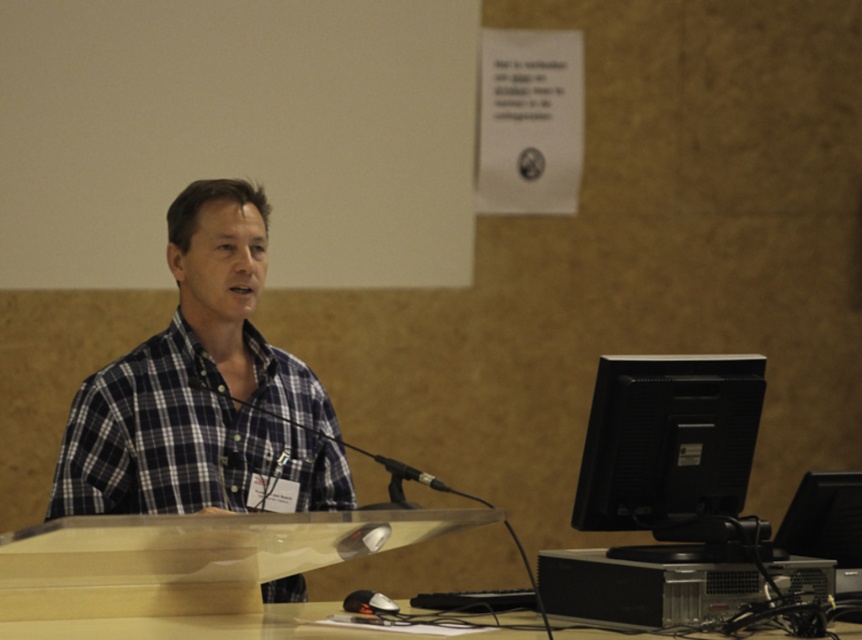
Is clear plastic table at center positioned at the back of wooden table at lower center?

No.

Is point (173, 522) behind point (191, 632)?

That is False.

You are a GUI agent. You are given a task and a screenshot of the screen. Output one action in this format:
    pyautogui.click(x=<x>, y=<y>)
    Task: Click on the clear plastic table at center
    The width and height of the screenshot is (862, 640).
    Given the screenshot: What is the action you would take?
    point(192,557)

I want to click on clear plastic table at center, so click(x=192, y=557).

Between plaid cotton shirt at center and black matte microphone at center, which one has less height?

black matte microphone at center

From the picture: Can you confirm if plaid cotton shirt at center is positioned above black matte microphone at center?

Yes.

Image resolution: width=862 pixels, height=640 pixels. I want to click on plaid cotton shirt at center, so click(x=203, y=390).

Is wooden table at lower center closer to camera compared to black matte microphone at center?

Yes, wooden table at lower center is closer to the viewer.

Can you confirm if wooden table at lower center is positioned to the left of black matte microphone at center?

No, wooden table at lower center is not to the left of black matte microphone at center.

Does point (19, 636) lie behind point (411, 506)?

No.

At what (x,y) coordinates should I click in order to perform the action: click on wooden table at lower center. Please return your answer as a coordinate pair (x, y). This screenshot has width=862, height=640. Looking at the image, I should click on (211, 627).